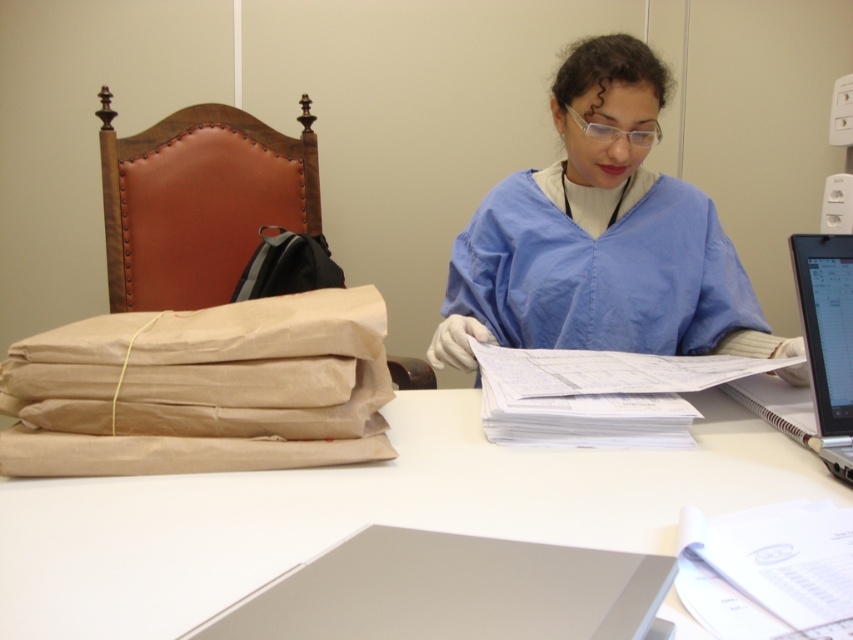
Question: Based on their relative distances, which object is nearer to the white matte table at center?

Choices:
 (A) silver metallic laptop at right
 (B) white paper at center

Answer: (B)

Question: Does white paper at center appear on the right side of silver metallic laptop at right?

Choices:
 (A) yes
 (B) no

Answer: (B)

Question: Which of the following is the closest to the observer?

Choices:
 (A) (822, 481)
 (B) (838, 243)

Answer: (A)

Question: Based on their relative distances, which object is nearer to the blue smooth scrubs at center?

Choices:
 (A) white paper at center
 (B) silver metallic laptop at right
 (C) white matte table at center

Answer: (C)

Question: Can you confirm if white paper at center is smaller than silver metallic laptop at right?

Choices:
 (A) yes
 (B) no

Answer: (B)

Question: Is white matte table at center further to the viewer compared to silver metallic laptop at right?

Choices:
 (A) no
 (B) yes

Answer: (A)